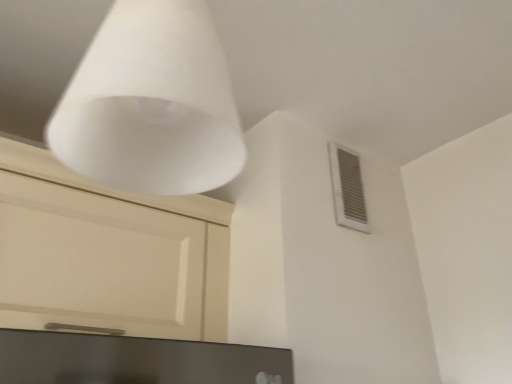
Question: From a real-world perspective, does white matte cone at upper center stand above white plastic vent at upper right?

Choices:
 (A) yes
 (B) no

Answer: (B)

Question: Considering the relative sizes of white matte cone at upper center and white plastic vent at upper right in the image provided, is white matte cone at upper center shorter than white plastic vent at upper right?

Choices:
 (A) no
 (B) yes

Answer: (B)

Question: Is white matte cone at upper center not inside white plastic vent at upper right?

Choices:
 (A) no
 (B) yes

Answer: (B)

Question: Is white matte cone at upper center turned away from white plastic vent at upper right?

Choices:
 (A) yes
 (B) no

Answer: (B)

Question: Is white plastic vent at upper right completely or partially inside white matte cone at upper center?

Choices:
 (A) no
 (B) yes

Answer: (A)

Question: From a real-world perspective, is matte black monitor at lower center positioned above or below white matte cone at upper center?

Choices:
 (A) above
 (B) below

Answer: (B)

Question: Considering their positions, is matte black monitor at lower center located in front of or behind white matte cone at upper center?

Choices:
 (A) behind
 (B) front

Answer: (A)

Question: From the image's perspective, is matte black monitor at lower center above or below white matte cone at upper center?

Choices:
 (A) below
 (B) above

Answer: (A)

Question: Considering the positions of matte black monitor at lower center and white matte cone at upper center in the image, is matte black monitor at lower center bigger or smaller than white matte cone at upper center?

Choices:
 (A) small
 (B) big

Answer: (A)

Question: From the image's perspective, is white matte cone at upper center located above or below white plastic vent at upper right?

Choices:
 (A) below
 (B) above

Answer: (B)

Question: Looking at the image, does white matte cone at upper center seem bigger or smaller compared to white plastic vent at upper right?

Choices:
 (A) big
 (B) small

Answer: (A)

Question: Is point (232, 117) closer or farther from the camera than point (347, 165)?

Choices:
 (A) closer
 (B) farther

Answer: (A)

Question: Relative to white plastic vent at upper right, is white matte cone at upper center in front or behind?

Choices:
 (A) front
 (B) behind

Answer: (A)

Question: From a real-world perspective, is matte black monitor at lower center positioned above or below white plastic vent at upper right?

Choices:
 (A) above
 (B) below

Answer: (B)

Question: Is matte black monitor at lower center in front of or behind white plastic vent at upper right in the image?

Choices:
 (A) front
 (B) behind

Answer: (A)